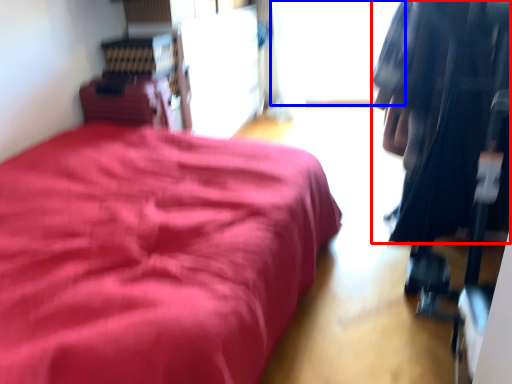
Question: Which of the following is the farthest to the observer, clothing (highlighted by a red box) or window (highlighted by a blue box)?

Choices:
 (A) clothing
 (B) window

Answer: (B)